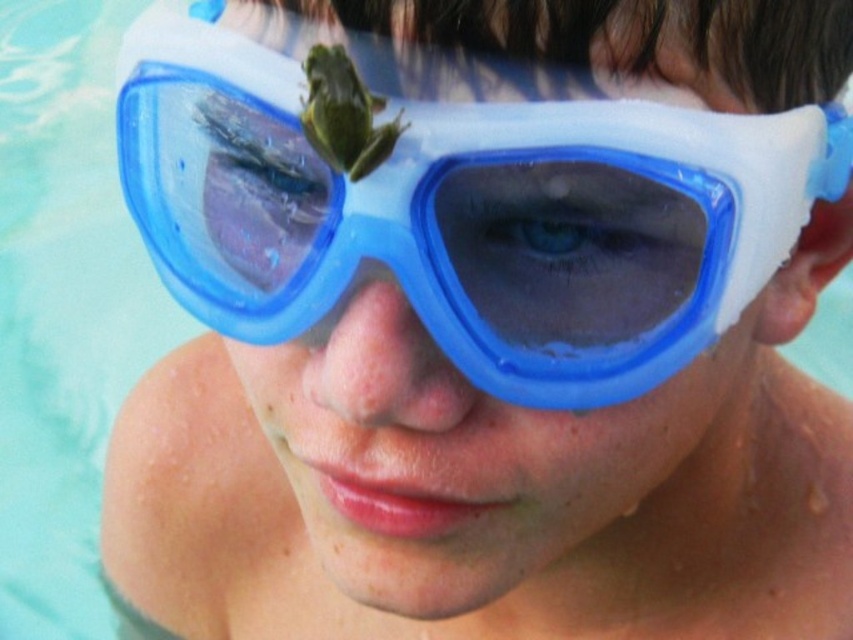
What are the coordinates of the transparent plastic goggles at center?

The transparent plastic goggles at center are located at coordinates point (x=477, y=502).